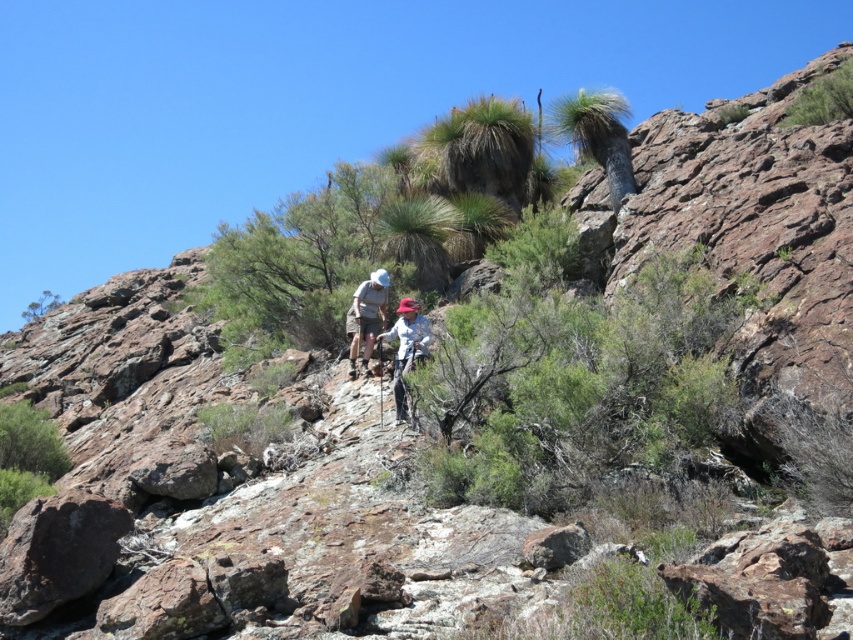
Question: Can you confirm if light brown fabric shirt at center is thinner than white fabric at center?

Choices:
 (A) no
 (B) yes

Answer: (B)

Question: Which point is farther from the camera taking this photo?

Choices:
 (A) click(376, 294)
 (B) click(415, 304)

Answer: (A)

Question: Which of the following is the farthest from the observer?

Choices:
 (A) (398, 394)
 (B) (361, 321)

Answer: (B)

Question: Does light brown fabric shirt at center appear over white fabric at center?

Choices:
 (A) no
 (B) yes

Answer: (B)

Question: Considering the relative positions of light brown fabric shirt at center and white fabric at center in the image provided, where is light brown fabric shirt at center located with respect to white fabric at center?

Choices:
 (A) above
 (B) below

Answer: (A)

Question: Which of the following is the farthest from the observer?

Choices:
 (A) white fabric at center
 (B) light brown fabric shirt at center

Answer: (B)